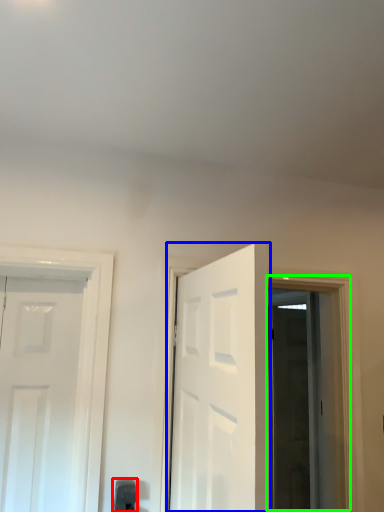
Question: Estimate the real-world distances between objects in this image. Which object is closer to door handle (highlighted by a red box), door (highlighted by a blue box) or window (highlighted by a green box)?

Choices:
 (A) door
 (B) window

Answer: (A)